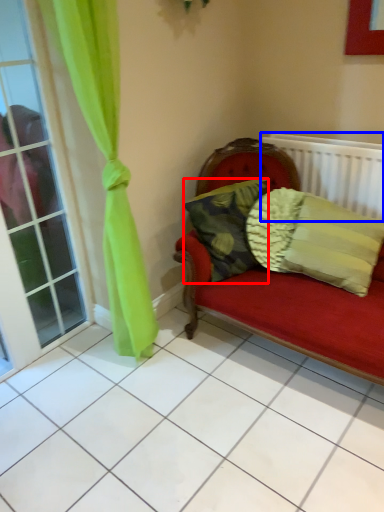
Question: Which object appears closest to the camera in this image, pillow (highlighted by a red box) or radiator (highlighted by a blue box)?

Choices:
 (A) pillow
 (B) radiator

Answer: (A)